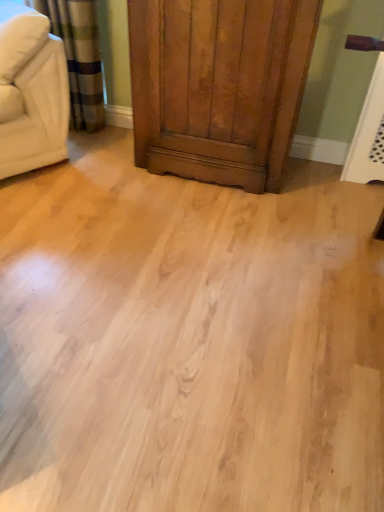
Question: Should I look upward or downward to see light wood floor at center?

Choices:
 (A) down
 (B) up

Answer: (B)

Question: Does shiny brown wood dresser at center turn towards light wood floor at center?

Choices:
 (A) no
 (B) yes

Answer: (B)

Question: From a real-world perspective, does shiny brown wood dresser at center stand above light wood floor at center?

Choices:
 (A) no
 (B) yes

Answer: (B)

Question: Can you confirm if shiny brown wood dresser at center is positioned to the right of light wood floor at center?

Choices:
 (A) no
 (B) yes

Answer: (B)

Question: From the image's perspective, is shiny brown wood dresser at center above light wood floor at center?

Choices:
 (A) yes
 (B) no

Answer: (A)

Question: Is shiny brown wood dresser at center smaller than light wood floor at center?

Choices:
 (A) yes
 (B) no

Answer: (B)

Question: Is shiny brown wood dresser at center to the left of light wood floor at center from the viewer's perspective?

Choices:
 (A) no
 (B) yes

Answer: (A)

Question: Does beige fabric couch at upper left have a greater height compared to light wood floor at center?

Choices:
 (A) yes
 (B) no

Answer: (A)

Question: Considering the relative sizes of beige fabric couch at upper left and light wood floor at center in the image provided, is beige fabric couch at upper left wider than light wood floor at center?

Choices:
 (A) yes
 (B) no

Answer: (B)

Question: Considering the relative positions of beige fabric couch at upper left and light wood floor at center in the image provided, is beige fabric couch at upper left to the left of light wood floor at center from the viewer's perspective?

Choices:
 (A) yes
 (B) no

Answer: (A)

Question: Would you say light wood floor at center is part of beige fabric couch at upper left's contents?

Choices:
 (A) no
 (B) yes

Answer: (A)

Question: Is beige fabric couch at upper left positioned with its back to light wood floor at center?

Choices:
 (A) no
 (B) yes

Answer: (A)

Question: Is the position of beige fabric couch at upper left more distant than that of light wood floor at center?

Choices:
 (A) yes
 (B) no

Answer: (A)

Question: From the image's perspective, is shiny brown wood dresser at center on top of beige fabric couch at upper left?

Choices:
 (A) yes
 (B) no

Answer: (B)